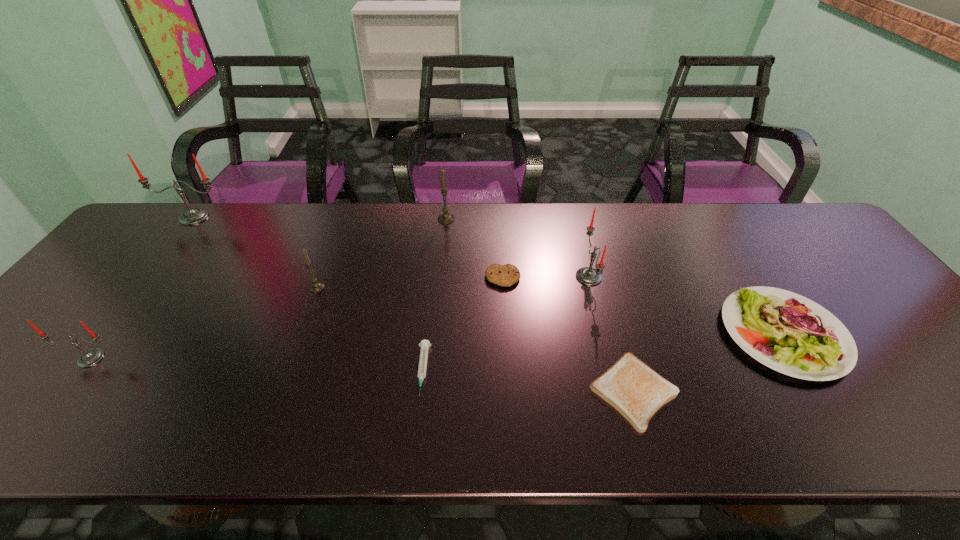
At what (x,y) coordinates should I click in order to perform the action: click on free space between the nearest candle and the white syringe. Please return your answer as a coordinate pair (x, y). Image resolution: width=960 pixels, height=540 pixels. Looking at the image, I should click on 257,364.

You are a GUI agent. You are given a task and a screenshot of the screen. Output one action in this format:
    pyautogui.click(x=<x>, y=<y>)
    Task: Click on the vacant point located between the farthest red candle and the shortest object
    
    Given the screenshot: What is the action you would take?
    pyautogui.click(x=414, y=304)

Identify the location of vacant point located between the white syringe and the sixth tallest object. (603, 352).

You are a GUI agent. You are given a task and a screenshot of the screen. Output one action in this format:
    pyautogui.click(x=<x>, y=<y>)
    Task: Click on the vacant space that is in between the shortest object and the white syringe
    
    Given the screenshot: What is the action you would take?
    pyautogui.click(x=528, y=381)

Locate an element on the screen. vacant area that lies between the left gray candle and the farther gray candle is located at coordinates (381, 253).

Select which object appears as the second closest to the bigger gray candle. Please provide its 2D coordinates. Your answer should be formatted as a tuple, i.e. [(x, y)], where the tuple contains the x and y coordinates of a point satisfying the conditions above.

[(589, 276)]

Find the location of `the second closest object relative to the smallest red candle`. the second closest object relative to the smallest red candle is located at coordinates (192, 216).

I want to click on candle that is the third nearest to the shortest object, so click(316, 286).

Locate an element on the screen. Image resolution: width=960 pixels, height=540 pixels. candle that stands as the third closest to the farther gray candle is located at coordinates (192, 216).

Find the location of a particular element. The height and width of the screenshot is (540, 960). red candle that is the closest to the brown cookie is located at coordinates (589, 276).